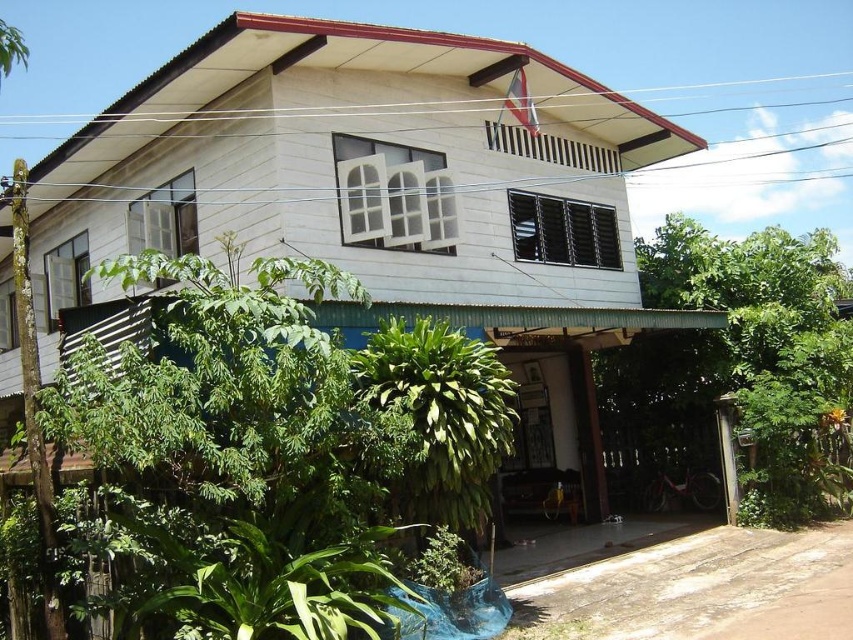
You are standing on the porch of the two story residential building and want to water both the green leafy plant at left and the green leafy plant at lower right. Which plant is closer to the porch entrance?

The green leafy plant at left is positioned under the green leafy plant at lower right, so the green leafy plant at left is closer to the porch entrance.

You are standing on the porch of the two story residential building and want to see the green leafy plant at lower center. Which direction should you look to avoid the green leafy plant at left blocking your view?

To see the green leafy plant at lower center without the green leafy plant at left blocking your view, you should look to the right side since the green leafy plant at left is positioned under it, meaning it is directly in front or to the left, so moving your gaze to the right would avoid the obstruction.

You are standing in front of the two story residential building and want to place a new bench. The bench requires at least 1 meter of space. Which area between the green leafy plant at left and the green leafy plant at lower center would be suitable for placing the bench?

The green leafy plant at left has a larger width than the green leafy plant at lower center. Therefore, the area near the green leafy plant at lower center would have more space and be suitable for placing the bench requiring at least 1 meter of space.